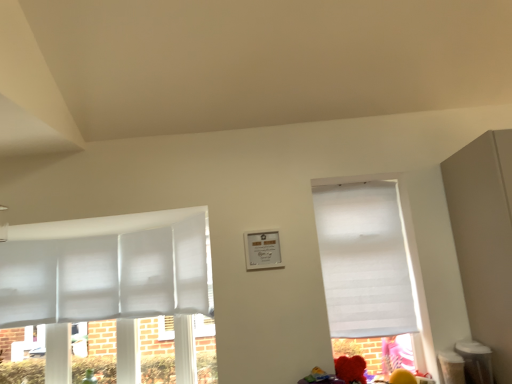
Question: Visually, is white fabric window at right positioned to the left or to the right of fluffy red teddy bear at lower right?

Choices:
 (A) right
 (B) left

Answer: (A)

Question: From a real-world perspective, relative to fluffy red teddy bear at lower right, is white fabric window at right vertically above or below?

Choices:
 (A) below
 (B) above

Answer: (B)

Question: Is white fabric window at right taller or shorter than fluffy red teddy bear at lower right?

Choices:
 (A) tall
 (B) short

Answer: (A)

Question: Considering the positions of fluffy red teddy bear at lower right and white fabric window at right in the image, is fluffy red teddy bear at lower right wider or thinner than white fabric window at right?

Choices:
 (A) thin
 (B) wide

Answer: (B)

Question: Choose the correct answer: Is fluffy red teddy bear at lower right inside white fabric window at right or outside it?

Choices:
 (A) outside
 (B) inside

Answer: (A)

Question: In terms of height, does fluffy red teddy bear at lower right look taller or shorter compared to white fabric window at right?

Choices:
 (A) tall
 (B) short

Answer: (B)

Question: From the image's perspective, is fluffy red teddy bear at lower right above or below white fabric window at right?

Choices:
 (A) below
 (B) above

Answer: (A)